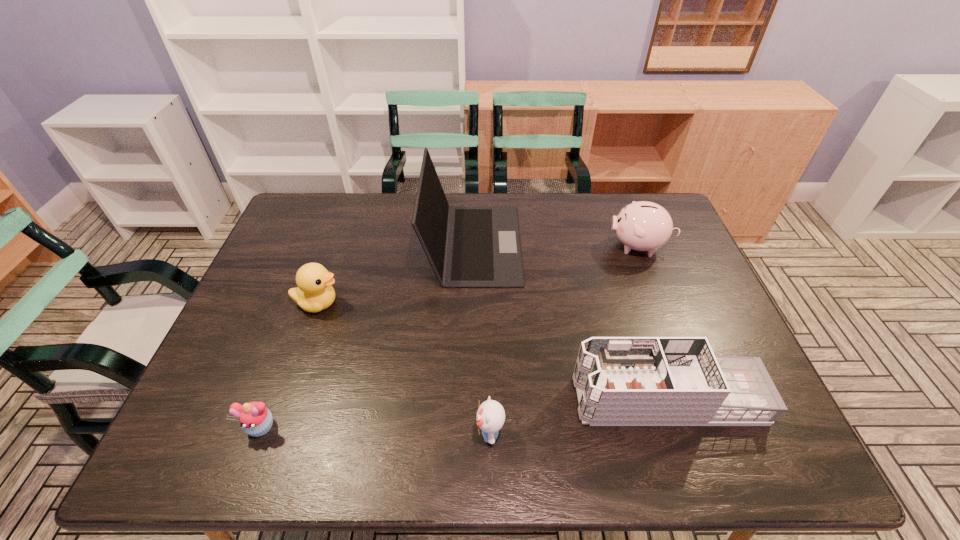
Image resolution: width=960 pixels, height=540 pixels. What are the coordinates of `vacant position located at the entrance of the dollhouse` in the screenshot? It's located at (527, 399).

Where is `free space located 0.360m on the face of the fourth nearest object`? The height and width of the screenshot is (540, 960). free space located 0.360m on the face of the fourth nearest object is located at coordinates (471, 303).

The width and height of the screenshot is (960, 540). I want to click on free location located on the front-facing side of the kitten, so click(x=374, y=433).

Find the location of a particular element. This screenshot has height=540, width=960. free region located on the front-facing side of the kitten is located at coordinates (389, 433).

Identify the location of blank space located 0.140m on the front-facing side of the kitten. This screenshot has width=960, height=540. (411, 433).

Find the location of `laptop at the far edge`. laptop at the far edge is located at coordinates (467, 246).

Locate an element on the screen. The height and width of the screenshot is (540, 960). piggy bank present at the far edge is located at coordinates pyautogui.click(x=642, y=226).

The image size is (960, 540). Identify the location of dollhouse present at the near edge. pyautogui.click(x=620, y=381).

The width and height of the screenshot is (960, 540). I want to click on kitten located at the near edge, so click(490, 417).

Locate an element on the screen. This screenshot has width=960, height=540. cupcake located in the near edge section of the desktop is located at coordinates pos(255,419).